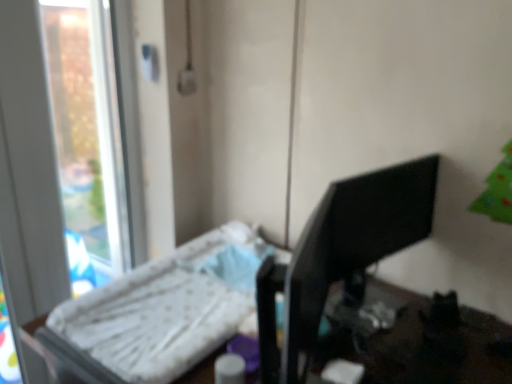
Identify the location of empty space that is to the right of black glossy monitor at right. This screenshot has height=384, width=512. (449, 328).